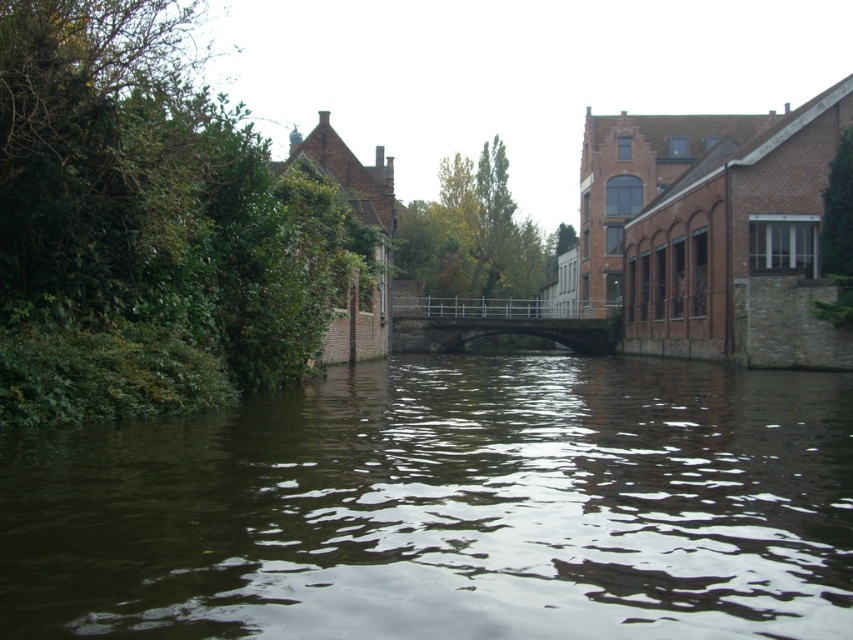
Question: Is brown water at center positioned before metallic gray bridge at center?

Choices:
 (A) yes
 (B) no

Answer: (A)

Question: Can you confirm if brown water at center is positioned to the right of metallic gray bridge at center?

Choices:
 (A) yes
 (B) no

Answer: (B)

Question: Does brown water at center appear under metallic gray bridge at center?

Choices:
 (A) yes
 (B) no

Answer: (A)

Question: Among these objects, which one is nearest to the camera?

Choices:
 (A) brown water at center
 (B) metallic gray bridge at center

Answer: (A)